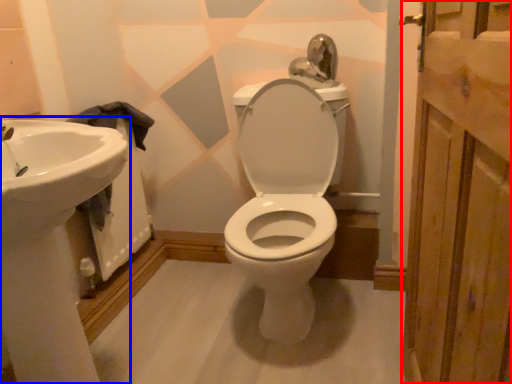
Question: Which object is further to the camera taking this photo, screen door (highlighted by a red box) or sink (highlighted by a blue box)?

Choices:
 (A) screen door
 (B) sink

Answer: (B)